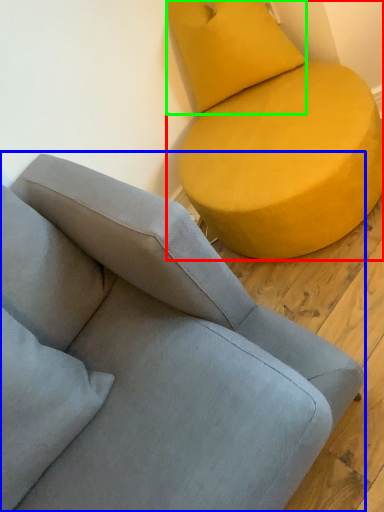
Question: Which is nearer to the studio couch (highlighted by a red box)? studio couch (highlighted by a blue box) or pillow (highlighted by a green box).

Choices:
 (A) studio couch
 (B) pillow

Answer: (B)